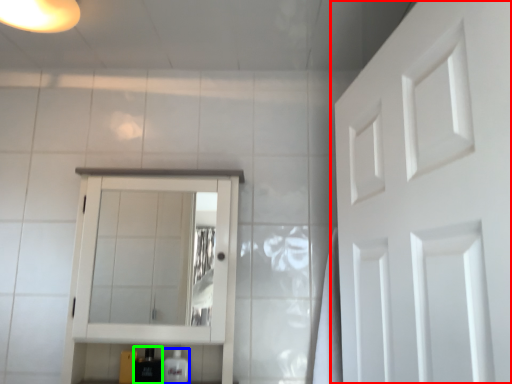
Question: Which object is positioned closest to door (highlighted by a red box)? Select from toiletry (highlighted by a blue box) and toiletry (highlighted by a green box).

Choices:
 (A) toiletry
 (B) toiletry

Answer: (A)